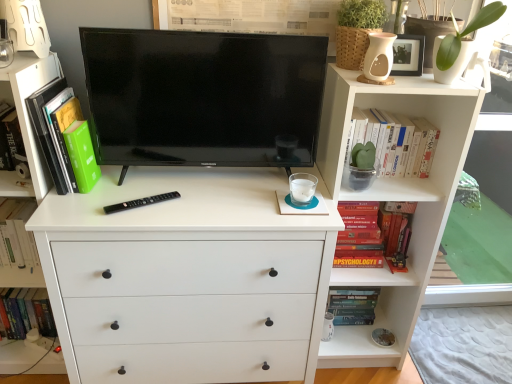
Where is `free point below white matte plain at lower right (from a real-world perspective)`? Image resolution: width=512 pixels, height=384 pixels. free point below white matte plain at lower right (from a real-world perspective) is located at coordinates (459, 349).